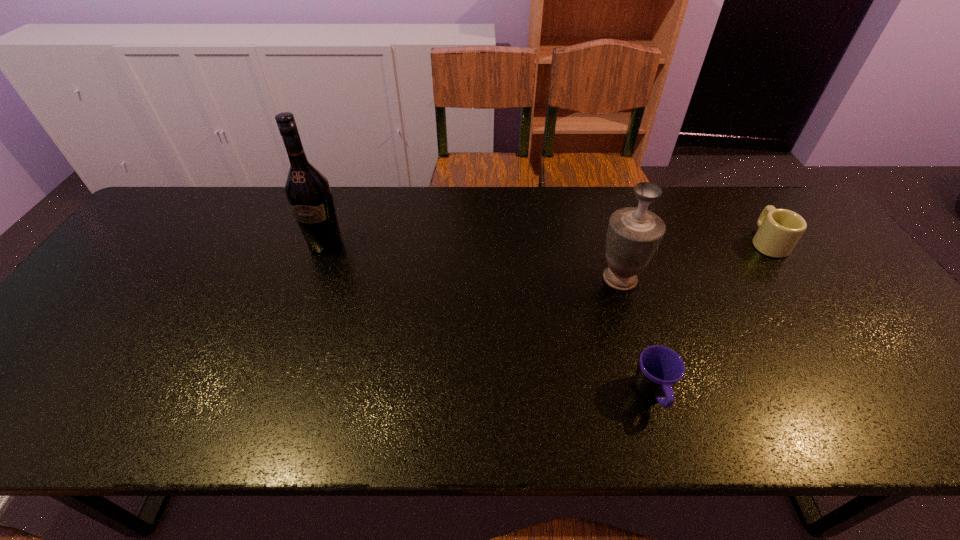
Locate an element on the screen. wine bottle is located at coordinates (308, 192).

Where is `the leftmost object`? This screenshot has width=960, height=540. the leftmost object is located at coordinates (308, 192).

The image size is (960, 540). I want to click on the second nearest object, so click(x=634, y=234).

Where is `the second tallest object`? the second tallest object is located at coordinates (634, 234).

Locate an element on the screen. the rightmost object is located at coordinates (779, 230).

The width and height of the screenshot is (960, 540). I want to click on the right mug, so click(779, 230).

Where is `the nearest object`? This screenshot has height=540, width=960. the nearest object is located at coordinates (660, 368).

I want to click on the nearer mug, so click(x=660, y=368).

The image size is (960, 540). Identify the location of free space located on the label of the leftmost object. (307, 293).

The height and width of the screenshot is (540, 960). I want to click on free space located 0.250m on the front of the urn, so click(x=651, y=382).